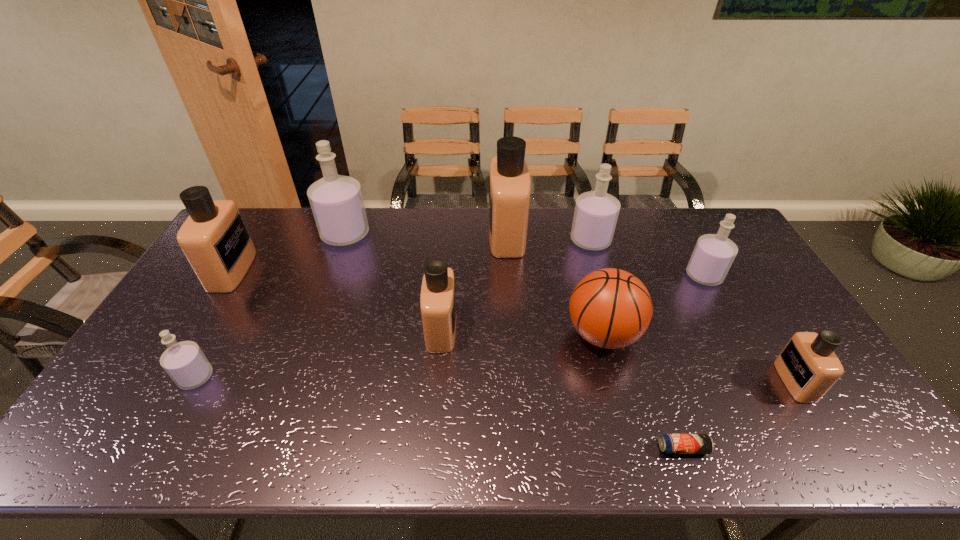
The height and width of the screenshot is (540, 960). In order to click on the fourth object from left to right in this screenshot , I will do `click(437, 299)`.

Image resolution: width=960 pixels, height=540 pixels. What are the coordinates of `basketball` in the screenshot? It's located at (610, 308).

At what (x,y) coordinates should I click in order to perform the action: click on the nearest purple perfume. Please return your answer as a coordinate pair (x, y). The width and height of the screenshot is (960, 540). Looking at the image, I should click on (186, 364).

Image resolution: width=960 pixels, height=540 pixels. I want to click on the leftmost purple perfume, so click(186, 364).

You are a GUI agent. You are given a task and a screenshot of the screen. Output one action in this format:
    pyautogui.click(x=<x>, y=<y>)
    Task: Click on the rightmost beige perfume
    This screenshot has height=540, width=960.
    Given the screenshot: What is the action you would take?
    808,366

Image resolution: width=960 pixels, height=540 pixels. What are the coordinates of `the smallest beige perfume` in the screenshot? It's located at (808, 366).

Locate an element on the screen. the shortest object is located at coordinates (669, 443).

At what (x,y) coordinates should I click in order to perform the action: click on beer can. Please return your answer as a coordinate pair (x, y). This screenshot has width=960, height=540. Looking at the image, I should click on (669, 443).

At what (x,y) coordinates should I click in order to perform the action: click on free region located 0.370m on the front label of the biggest beige perfume. Please return your answer as a coordinate pair (x, y). Image resolution: width=960 pixels, height=540 pixels. Looking at the image, I should click on (387, 235).

What are the coordinates of `free space located on the front label of the biggest beige perfume` in the screenshot? It's located at (384, 235).